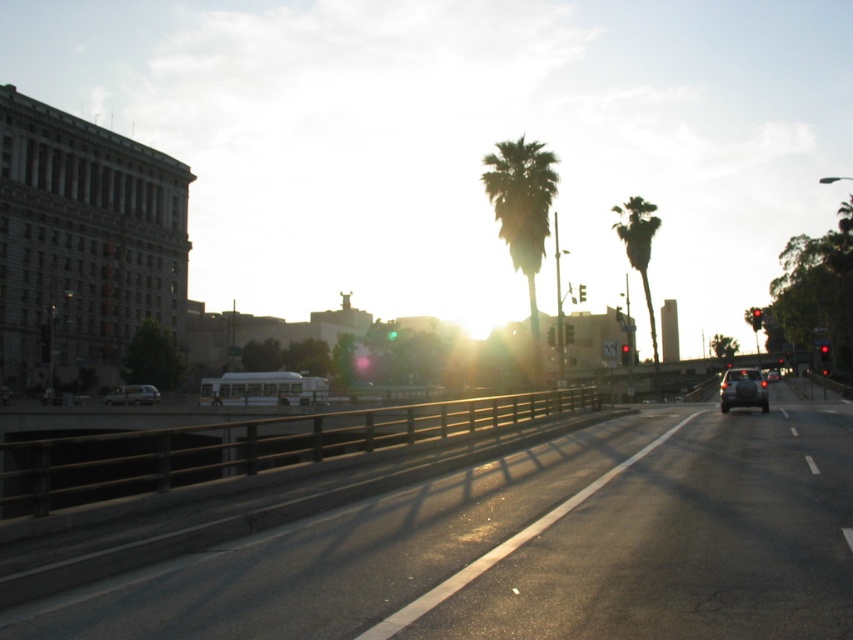
You are standing at the point with coordinates 0.5, 0.5. You want to walk to the metallic silver sedan at center. Which direction should you move in?

You should move to the right and downward to reach the metallic silver sedan at center, since it is located at point (743, 388), which is to the right and below your current position at (426, 320).

You are driving a car and see the metallic silver sedan at center and the silhouette leafy palm at center in your rearview mirror. Which object will appear closer to the top of the mirror?

The silhouette leafy palm at center appears closer to the top of the mirror because it is positioned to the left of the metallic silver sedan at center, and objects further to the left in the scene would be higher in the mirror.

You are driving a car and want to park behind the metallic silver sedan at center and the matte silver van at left. Which vehicle should you position your car behind to ensure it is farther from the viewer?

You should position your car behind the matte silver van at left because the metallic silver sedan at center is closer to the viewer than the matte silver van at left, meaning the van is farther away.